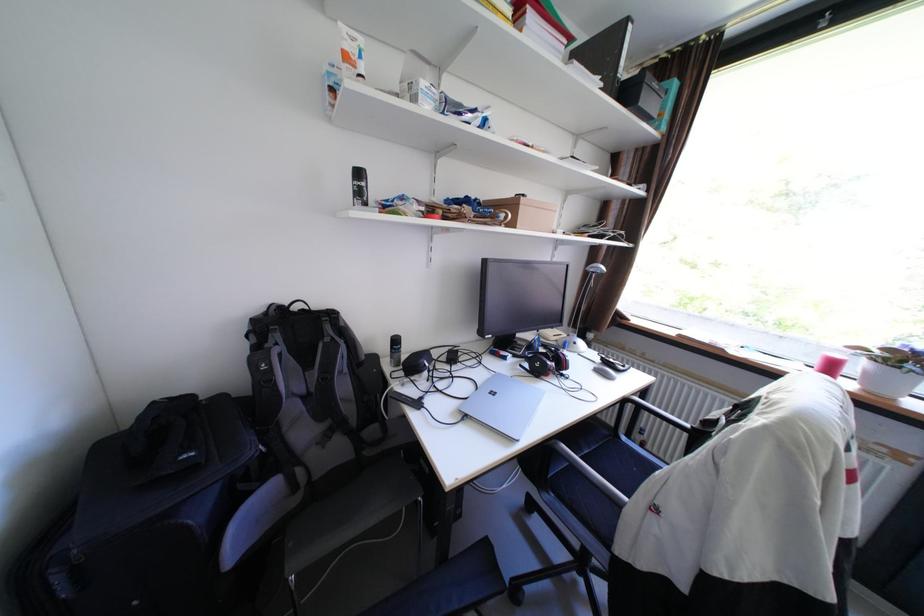
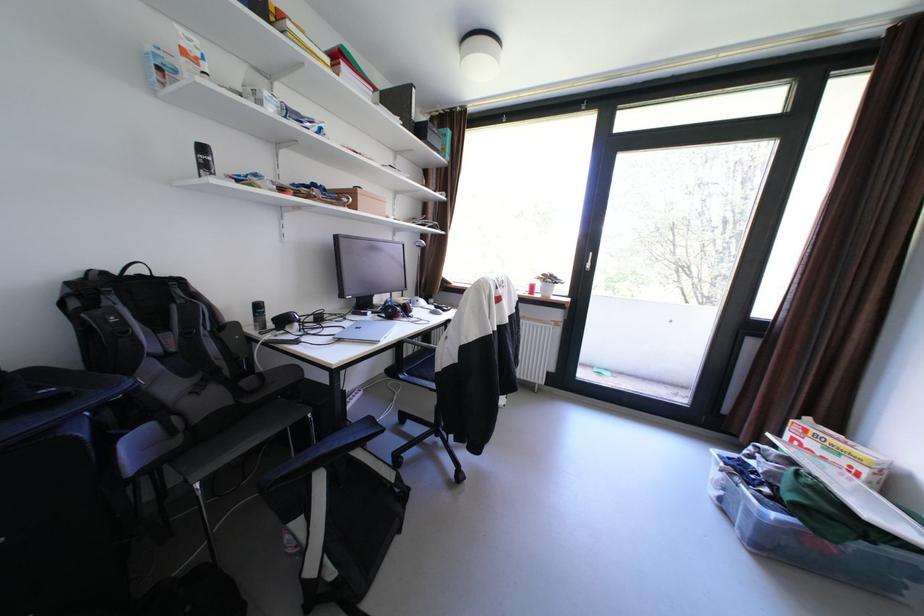
Question: The camera is either moving clockwise (left) or counter-clockwise (right) around the object. The first image is from the beginning of the video and the second image is from the end. Is the camera moving left or right when shooting the video?

Choices:
 (A) Left
 (B) Right

Answer: (A)